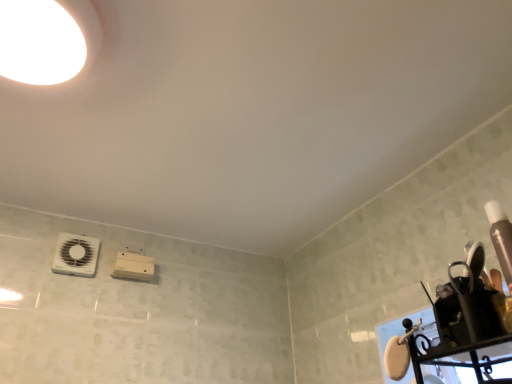
Measure the distance between white plastic fan at lower left and camera.

white plastic fan at lower left is 5.24 feet away from camera.

Describe the element at coordinates (76, 255) in the screenshot. I see `white plastic fan at lower left` at that location.

In order to click on white plastic fan at lower left in this screenshot , I will do `click(76, 255)`.

You are a GUI agent. You are given a task and a screenshot of the screen. Output one action in this format:
    pyautogui.click(x=<x>, y=<y>)
    Task: Click on the white glossy droplight at upper left
    This screenshot has width=512, height=384.
    Given the screenshot: What is the action you would take?
    pyautogui.click(x=39, y=42)

Describe the element at coordinates (39, 42) in the screenshot. I see `white glossy droplight at upper left` at that location.

I want to click on white plastic fan at lower left, so click(x=76, y=255).

Would you say white plastic fan at lower left is to the left or to the right of white glossy droplight at upper left in the picture?

Clearly, white plastic fan at lower left is on the left of white glossy droplight at upper left in the image.

Which object is more forward, white plastic fan at lower left or white glossy droplight at upper left?

Positioned in front is white glossy droplight at upper left.

Is point (67, 257) closer or farther from the camera than point (74, 62)?

Point (67, 257) is positioned farther from the camera compared to point (74, 62).

From the image's perspective, would you say white plastic fan at lower left is positioned over white glossy droplight at upper left?

No, from the image's perspective, white plastic fan at lower left is not above white glossy droplight at upper left.

From a real-world perspective, is white plastic fan at lower left located beneath white glossy droplight at upper left?

Yes, from a real-world perspective, white plastic fan at lower left is below white glossy droplight at upper left.

Considering the sizes of white plastic fan at lower left and white glossy droplight at upper left in the image, is white plastic fan at lower left wider or thinner than white glossy droplight at upper left?

Considering their sizes, white plastic fan at lower left looks slimmer than white glossy droplight at upper left.

Between white plastic fan at lower left and white glossy droplight at upper left, which one has more height?

With more height is white plastic fan at lower left.

Which of these two, white plastic fan at lower left or white glossy droplight at upper left, is bigger?

With larger size is white glossy droplight at upper left.

Do you think white plastic fan at lower left is within white glossy droplight at upper left, or outside of it?

white plastic fan at lower left exists outside the volume of white glossy droplight at upper left.

Is there a large distance between white plastic fan at lower left and white glossy droplight at upper left?

No, there isn't a large distance between white plastic fan at lower left and white glossy droplight at upper left.

Is white plastic fan at lower left turned away from white glossy droplight at upper left?

No, white plastic fan at lower left is not facing away from white glossy droplight at upper left.

How many degrees apart are the facing directions of white plastic fan at lower left and white glossy droplight at upper left?

They differ by 1.96 degrees in their facing directions.

How distant is white plastic fan at lower left from white glossy droplight at upper left?

white plastic fan at lower left and white glossy droplight at upper left are 35.62 inches apart.

Identify the location of droplight on the right of the white plastic fan at lower left. This screenshot has height=384, width=512. (39, 42).

Considering the positions of objects white glossy droplight at upper left and white plastic fan at lower left in the image provided, who is more to the left, white glossy droplight at upper left or white plastic fan at lower left?

white plastic fan at lower left is more to the left.

Relative to white plastic fan at lower left, is white glossy droplight at upper left in front or behind?

In the image, white glossy droplight at upper left appears in front of white plastic fan at lower left.

Which is nearer, (42, 66) or (81, 249)?

Point (42, 66) is positioned closer to the camera compared to point (81, 249).

From the image's perspective, is white glossy droplight at upper left below white plastic fan at lower left?

Actually, white glossy droplight at upper left appears above white plastic fan at lower left in the image.

From a real-world perspective, is white glossy droplight at upper left physically below white plastic fan at lower left?

No, from a real-world perspective, white glossy droplight at upper left is not under white plastic fan at lower left.

Which of these two, white glossy droplight at upper left or white plastic fan at lower left, is thinner?

white plastic fan at lower left.

Based on the photo, can you confirm if white glossy droplight at upper left is taller than white plastic fan at lower left?

In fact, white glossy droplight at upper left may be shorter than white plastic fan at lower left.

Between white glossy droplight at upper left and white plastic fan at lower left, which one has smaller size?

white plastic fan at lower left.

Is white glossy droplight at upper left outside of white plastic fan at lower left?

white glossy droplight at upper left lies outside white plastic fan at lower left's area.

Is white glossy droplight at upper left positioned far away from white plastic fan at lower left?

They are positioned close to each other.

From the picture: Is white glossy droplight at upper left positioned with its back to white plastic fan at lower left?

Absolutely, white glossy droplight at upper left is directed away from white plastic fan at lower left.

How many degrees apart are the facing directions of white glossy droplight at upper left and white plastic fan at lower left?

They differ by 1.96 degrees in their facing directions.

How much distance is there between white glossy droplight at upper left and white plastic fan at lower left?

white glossy droplight at upper left and white plastic fan at lower left are 90.47 centimeters apart.

Where is `droplight above the white plastic fan at lower left (from the image's perspective)`? droplight above the white plastic fan at lower left (from the image's perspective) is located at coordinates coord(39,42).

The width and height of the screenshot is (512, 384). Identify the location of appliance below the white glossy droplight at upper left (from the image's perspective). (76, 255).

Locate an element on the screen. The image size is (512, 384). droplight located above the white plastic fan at lower left (from the image's perspective) is located at coordinates (39, 42).